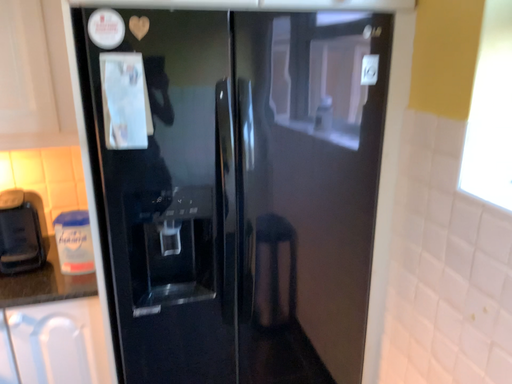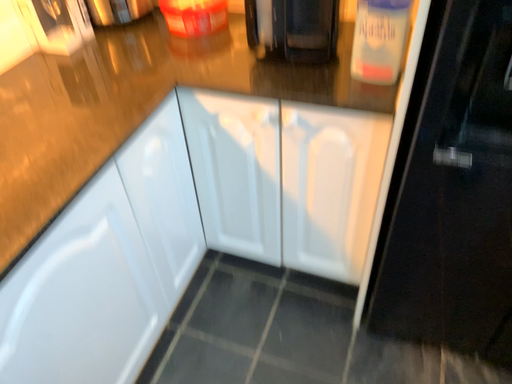
Question: How did the camera likely rotate when shooting the video?

Choices:
 (A) rotated downward
 (B) rotated upward

Answer: (A)